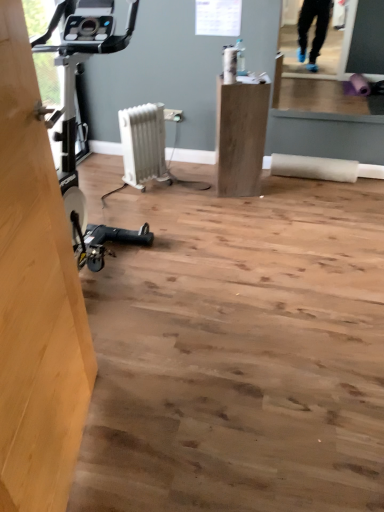
Identify the location of vacant space underneath light brown wood at left (from a real-world perspective). (86, 446).